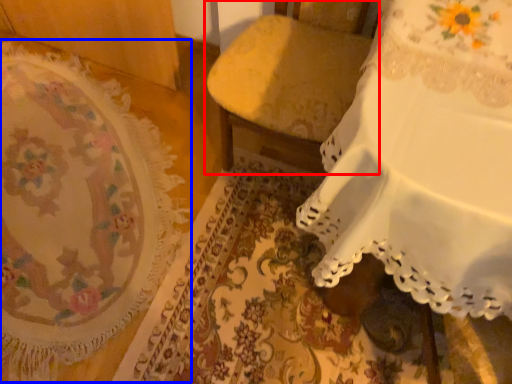
Question: Among these objects, which one is farthest to the camera, furniture (highlighted by a red box) or mat (highlighted by a blue box)?

Choices:
 (A) furniture
 (B) mat

Answer: (B)